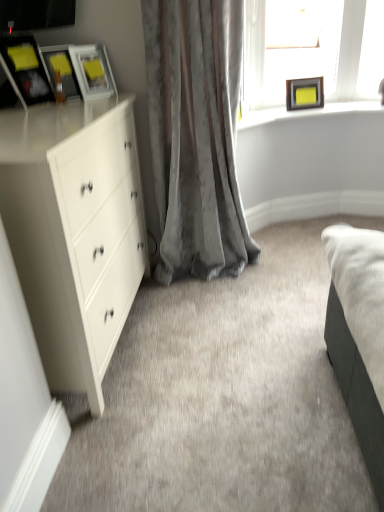
Image resolution: width=384 pixels, height=512 pixels. I want to click on free space in front of matte white picture frame at upper left, the second picture frame when ordered from back to front, so point(86,102).